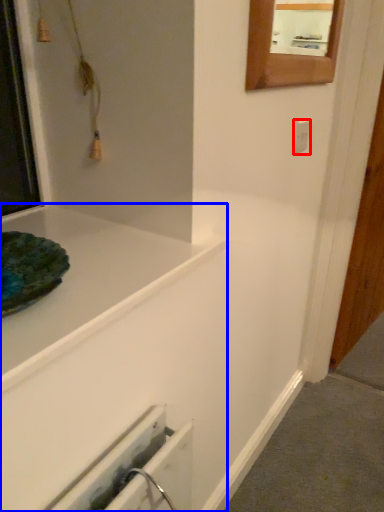
Question: Which object appears closest to the camera in this image, electric outlet (highlighted by a red box) or bathtub (highlighted by a blue box)?

Choices:
 (A) electric outlet
 (B) bathtub

Answer: (B)